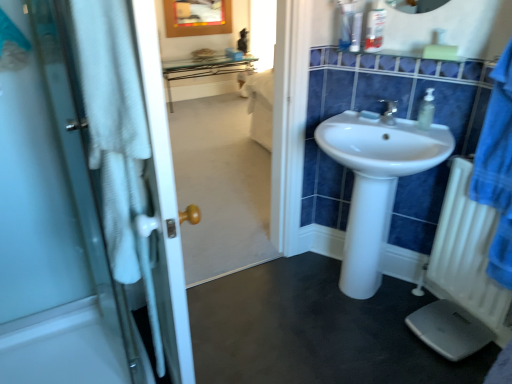
Identify the location of free location to the left of white glossy sink at center. (271, 306).